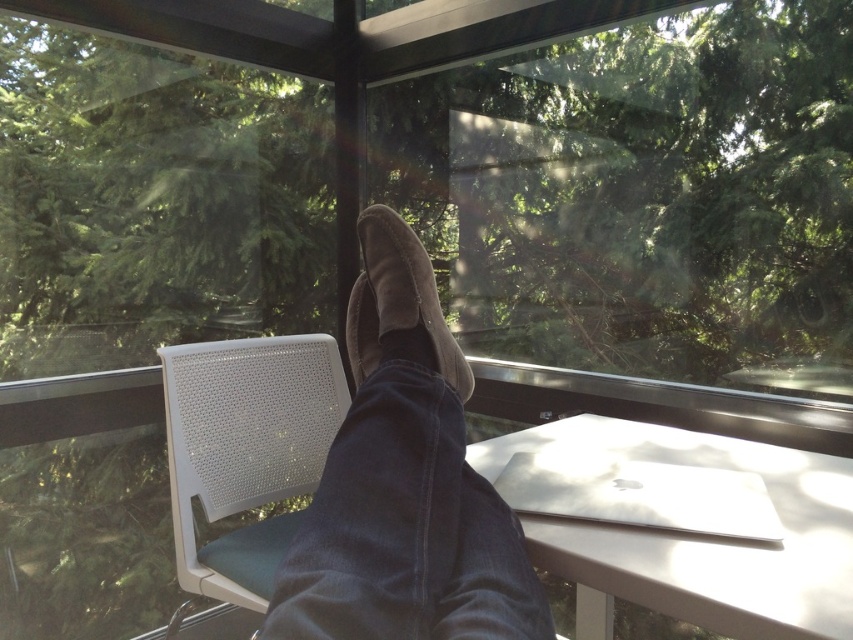
Question: Which object appears closest to the camera in this image?

Choices:
 (A) white mesh chair at left
 (B) brown suede shoes at center

Answer: (B)

Question: Which object appears closest to the camera in this image?

Choices:
 (A) white glossy table at lower right
 (B) brown suede shoes at center
 (C) suede-like brown shoe at center
 (D) white mesh chair at left

Answer: (B)

Question: Estimate the real-world distances between objects in this image. Which object is farther from the white glossy table at lower right?

Choices:
 (A) suede-like brown shoe at center
 (B) brown suede shoes at center
 (C) white mesh chair at left

Answer: (C)

Question: Can you confirm if white glossy table at lower right is wider than suede-like brown shoe at center?

Choices:
 (A) no
 (B) yes

Answer: (B)

Question: Can you confirm if white glossy table at lower right is positioned below suede-like brown shoe at center?

Choices:
 (A) no
 (B) yes

Answer: (B)

Question: Can you confirm if white mesh chair at left is wider than suede-like brown shoe at center?

Choices:
 (A) yes
 (B) no

Answer: (A)